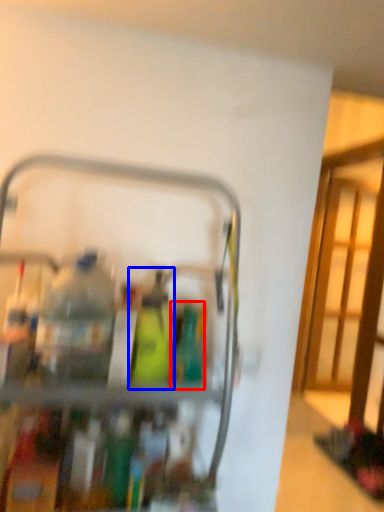
Question: Among these objects, which one is nearest to the camera, bottle (highlighted by a red box) or bottle (highlighted by a blue box)?

Choices:
 (A) bottle
 (B) bottle

Answer: (B)